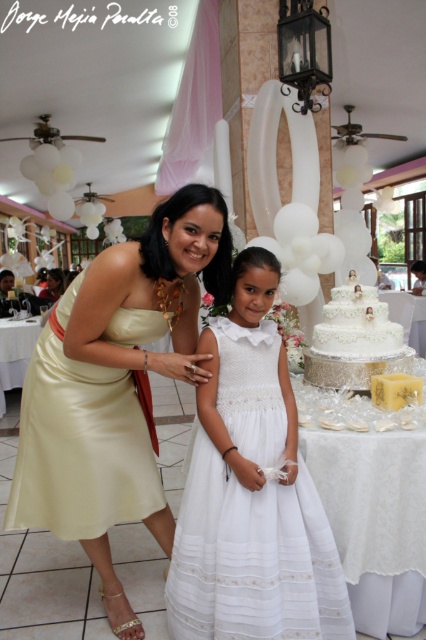
Based on the scene description, where exactly is the satin gold dress at left located in the image?

The satin gold dress at left is located at point (x=80, y=449).

You are a photographer at the wedding reception. You need to capture a photo that includes both the satin gold dress at left and the white textured cake at center. Considering their heights, which object should you position closer to the camera to ensure both are fully visible in the frame?

The satin gold dress at left is much taller than the white textured cake at center. To ensure both are fully visible in the frame, position the white textured cake at center closer to the camera so its height matches the dress.

You are a photographer at a wedding reception and need to capture a photo of the white sheer dress at center and the white textured cake at center. Based on their positions, which object should you focus on first to ensure both are in frame?

The white sheer dress at center is located below the white textured cake at center, so you should focus on the white textured cake at center first to ensure both are in frame.